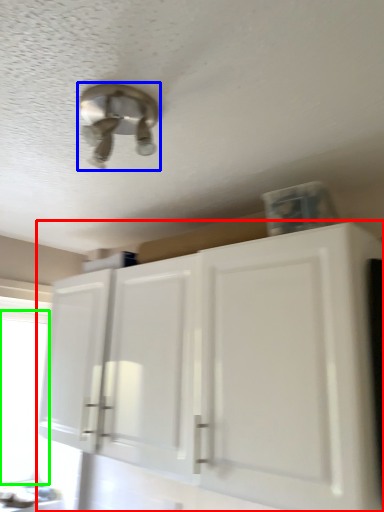
Question: Based on their relative distances, which object is farther from cabinetry (highlighted by a red box)? Choose from light fixture (highlighted by a blue box) and window screen (highlighted by a green box).

Choices:
 (A) light fixture
 (B) window screen

Answer: (B)